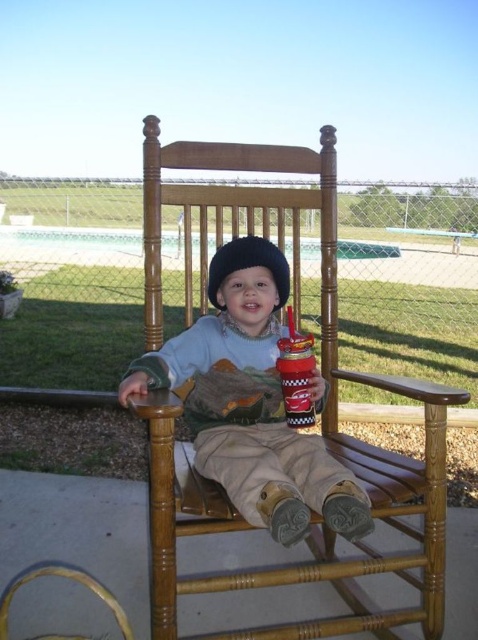
You are standing in front of the wooden rocking chair and want to place a small gift exactly at point (152,333). If your arm can reach 1.6 meters, can you reach that point without moving your feet?

The point (152,333) is 1.59 meters away from the camera, so yes, you can reach it with your arm since it is within your 1.6 meters reach.

From the picture: You are a photographer setting up a shoot with a matte plastic toddler at center and a fuzzy black hat at center. You want to place a small prop between them. Where should you position the prop so it is equidistant from both objects?

The prop should be placed exactly halfway between the matte plastic toddler at center and the fuzzy black hat at center, since the matte plastic toddler at center is on the left side of the fuzzy black hat at center.

Based on the scene description, where is the wooden rocking chair at center located in terms of its 2D coordinates?

The wooden rocking chair at center is located at the 2D coordinates of point (321,416).